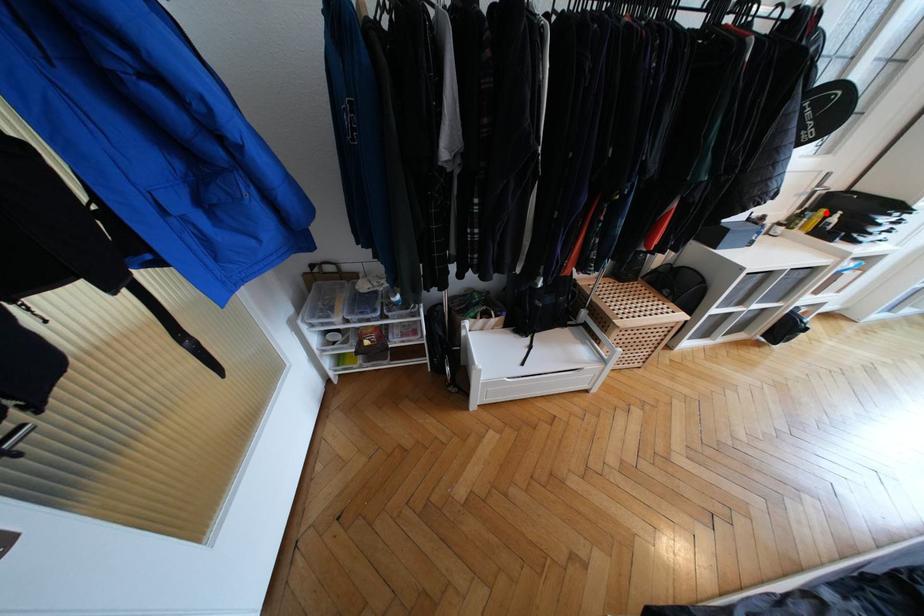
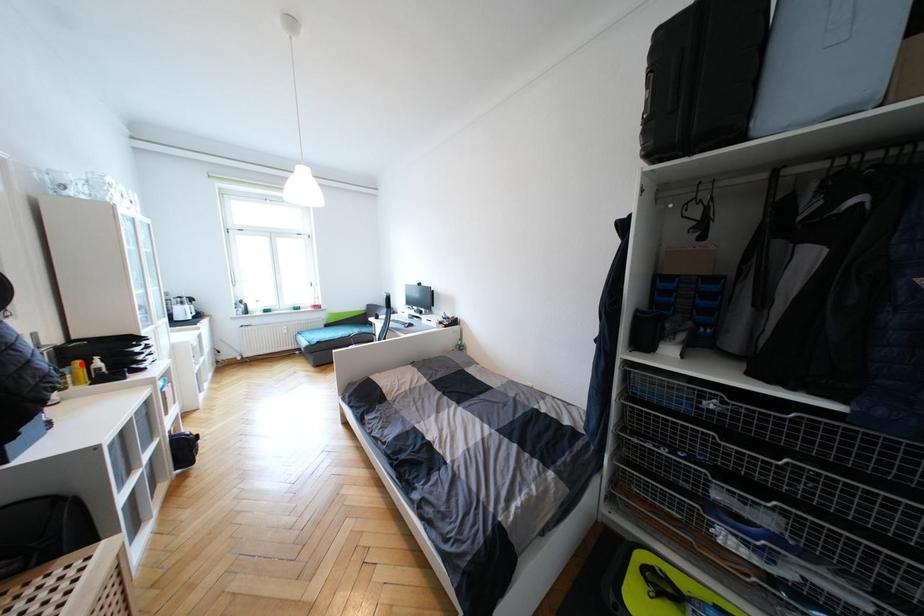
I am providing you with two images of the same scene from different viewpoints. A red point is marked on the first image and another point is marked on the second image. Are the points marked in image1 and image2 representing the same 3D position?

Yes